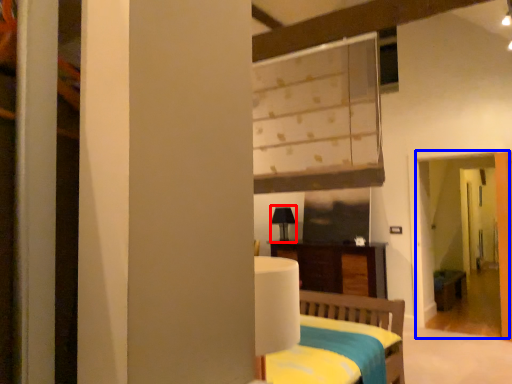
Question: Which point is closer to the camera, table lamp (highlighted by a red box) or screen door (highlighted by a blue box)?

Choices:
 (A) table lamp
 (B) screen door

Answer: (B)